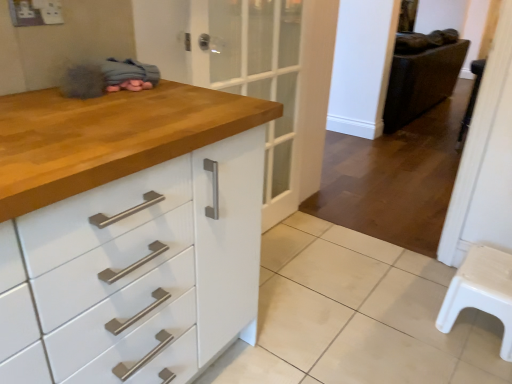
Where is `vacant space behind white plastic stool at lower right`? The height and width of the screenshot is (384, 512). vacant space behind white plastic stool at lower right is located at coordinates (420, 279).